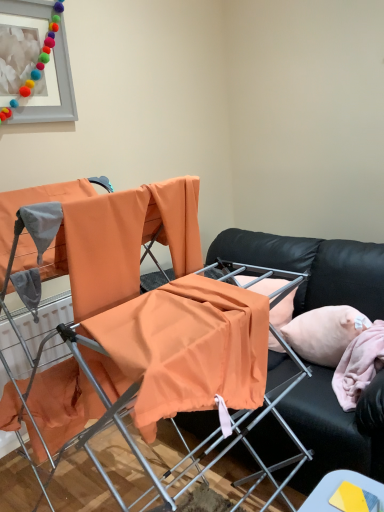
What do you see at coordinates (313, 267) in the screenshot?
I see `black leather couch at center` at bounding box center [313, 267].

This screenshot has width=384, height=512. What do you see at coordinates (48, 62) in the screenshot?
I see `matte gray picture frame at upper left` at bounding box center [48, 62].

Find the location of `smooth yellow card at lower right`. smooth yellow card at lower right is located at coordinates (345, 493).

Could pink fabric pillow at right be considered to be inside orange fabric chair at center?

Actually, pink fabric pillow at right is outside orange fabric chair at center.

Is orange fabric chair at center not near pink fabric pillow at right?

No, orange fabric chair at center is not far from pink fabric pillow at right.

Which is closer, (91, 398) or (312, 340)?

Point (91, 398)

Which object is positioned more to the left, orange fabric chair at center or black leather couch at center?

orange fabric chair at center is more to the left.

Between orange fabric chair at center and black leather couch at center, which one has smaller width?

With smaller width is orange fabric chair at center.

From the image's perspective, is orange fabric chair at center located above black leather couch at center?

Yes, from the image's perspective, orange fabric chair at center is on top of black leather couch at center.

Identify the location of studio couch below the orange fabric chair at center (from a real-world perspective). (313, 267).

Considering the sizes of objects matte gray picture frame at upper left and black leather couch at center in the image provided, who is smaller, matte gray picture frame at upper left or black leather couch at center?

With smaller size is matte gray picture frame at upper left.

Visually, is matte gray picture frame at upper left positioned to the left or to the right of black leather couch at center?

In the image, matte gray picture frame at upper left appears on the left side of black leather couch at center.

From a real-world perspective, which is physically below, matte gray picture frame at upper left or black leather couch at center?

black leather couch at center is physically lower.

Consider the image. Measure the distance from matte gray picture frame at upper left to smooth yellow card at lower right.

2.01 meters.

Considering the relative sizes of matte gray picture frame at upper left and smooth yellow card at lower right in the image provided, is matte gray picture frame at upper left wider than smooth yellow card at lower right?

Incorrect, the width of matte gray picture frame at upper left does not surpass that of smooth yellow card at lower right.

Are matte gray picture frame at upper left and smooth yellow card at lower right located far from each other?

Yes, matte gray picture frame at upper left and smooth yellow card at lower right are quite far apart.

Where is `picture frame lying above the smooth yellow card at lower right (from the image's perspective)`? The width and height of the screenshot is (384, 512). picture frame lying above the smooth yellow card at lower right (from the image's perspective) is located at coordinates (48, 62).

Does black leather couch at center turn towards matte gray picture frame at upper left?

No.

Is black leather couch at center situated inside matte gray picture frame at upper left or outside?

black leather couch at center is located beyond the bounds of matte gray picture frame at upper left.

How distant is black leather couch at center from matte gray picture frame at upper left?

black leather couch at center and matte gray picture frame at upper left are 1.31 meters apart from each other.

Does point (269, 352) come farther from viewer compared to point (25, 88)?

No, it is not.

Where is `table lying in front of the black leather couch at center`? The height and width of the screenshot is (512, 384). table lying in front of the black leather couch at center is located at coordinates (345, 493).

Does black leather couch at center lie behind smooth yellow card at lower right?

That is True.

Based on the photo, is smooth yellow card at lower right surrounded by black leather couch at center?

Actually, smooth yellow card at lower right is outside black leather couch at center.

What's the angular difference between black leather couch at center and smooth yellow card at lower right's facing directions?

2.68 degrees separate the facing orientations of black leather couch at center and smooth yellow card at lower right.

Measure the distance from smooth yellow card at lower right to orange fabric chair at center.

smooth yellow card at lower right and orange fabric chair at center are 25.27 inches apart.

Is smooth yellow card at lower right placed right next to orange fabric chair at center?

No, smooth yellow card at lower right is not beside orange fabric chair at center.

Is smooth yellow card at lower right not inside orange fabric chair at center?

Yes, smooth yellow card at lower right is not within orange fabric chair at center.

From a real-world perspective, is smooth yellow card at lower right physically below orange fabric chair at center?

Yes.

Locate an element on the screen. This screenshot has width=384, height=512. chair in front of the pink fabric pillow at right is located at coordinates (142, 323).

Locate an element on the screen. The image size is (384, 512). chair above the black leather couch at center (from a real-world perspective) is located at coordinates (142, 323).

Considering their positions, is orange fabric chair at center positioned closer to black leather couch at center than matte gray picture frame at upper left?

Among the two, orange fabric chair at center is located nearer to black leather couch at center.

Which object lies further to the anchor point pink fabric pillow at right, smooth yellow card at lower right or orange fabric chair at center?

orange fabric chair at center lies further to pink fabric pillow at right than the other object.

Which object lies further to the anchor point orange fabric chair at center, matte gray picture frame at upper left or smooth yellow card at lower right?

The object further to orange fabric chair at center is matte gray picture frame at upper left.

When comparing their distances from black leather couch at center, does matte gray picture frame at upper left or pink fabric pillow at right seem closer?

The object closer to black leather couch at center is pink fabric pillow at right.

Considering their positions, is pink fabric pillow at right positioned further to orange fabric chair at center than smooth yellow card at lower right?

pink fabric pillow at right lies further to orange fabric chair at center than the other object.

From the image, which object appears to be nearer to orange fabric chair at center, black leather couch at center or pink fabric pillow at right?

Among the two, pink fabric pillow at right is located nearer to orange fabric chair at center.

In the scene shown: Looking at the image, which one is located closer to matte gray picture frame at upper left, orange fabric chair at center or black leather couch at center?

orange fabric chair at center.

Looking at the image, which one is located closer to smooth yellow card at lower right, matte gray picture frame at upper left or pink fabric pillow at right?

pink fabric pillow at right lies closer to smooth yellow card at lower right than the other object.

Where is `studio couch between smooth yellow card at lower right and pink fabric pillow at right from front to back`? The width and height of the screenshot is (384, 512). studio couch between smooth yellow card at lower right and pink fabric pillow at right from front to back is located at coordinates (313, 267).

The image size is (384, 512). Find the location of `pillow between matte gray picture frame at upper left and smooth yellow card at lower right vertically`. pillow between matte gray picture frame at upper left and smooth yellow card at lower right vertically is located at coordinates (324, 333).

Where is `table between orange fabric chair at center and pink fabric pillow at right along the z-axis`? The width and height of the screenshot is (384, 512). table between orange fabric chair at center and pink fabric pillow at right along the z-axis is located at coordinates (345, 493).

Where is `studio couch between matte gray picture frame at upper left and smooth yellow card at lower right in the vertical direction`? The width and height of the screenshot is (384, 512). studio couch between matte gray picture frame at upper left and smooth yellow card at lower right in the vertical direction is located at coordinates (313, 267).